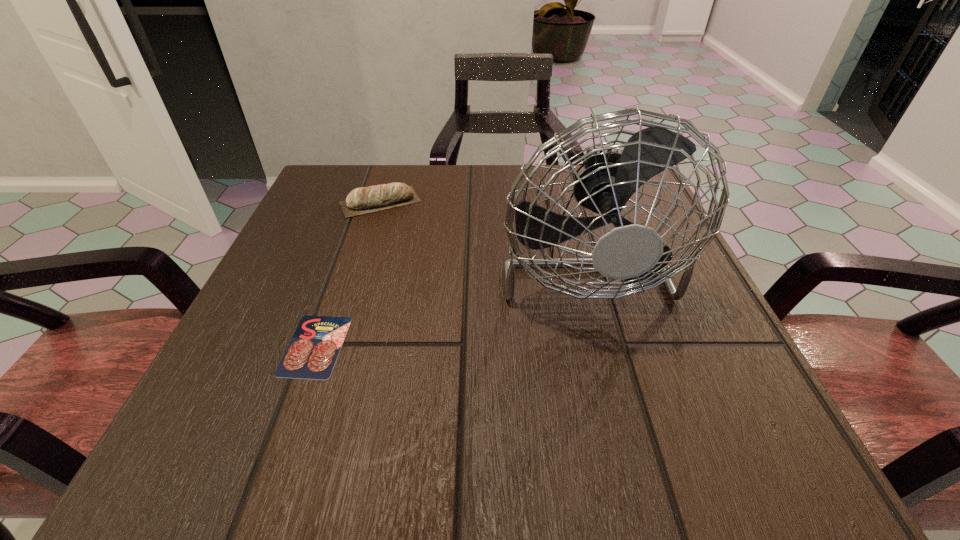
Identify the location of object that is the closest to the pita bread. (630, 252).

Identify the location of object that is the nearest to the pita bread. (630, 252).

Identify the location of vacant space that satisfies the following two spatial constraints: 1. on the back side of the second shortest object; 2. on the right side of the shortest object. (366, 202).